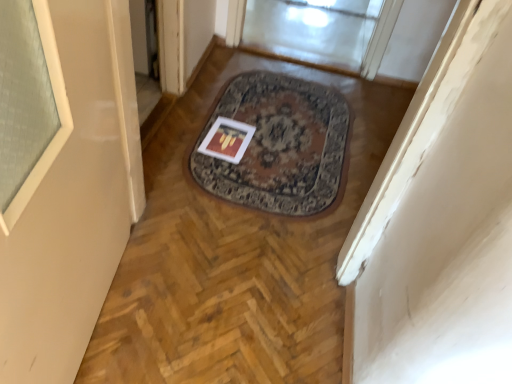
What do you see at coordinates (318, 32) in the screenshot? Image resolution: width=512 pixels, height=384 pixels. I see `transparent glass door at upper center` at bounding box center [318, 32].

I want to click on transparent glass door at upper center, so click(x=318, y=32).

What is the approximate height of transparent glass door at upper center?

1.51 inches.

Where is `matte paper postcard at center`? matte paper postcard at center is located at coordinates (227, 140).

Describe the element at coordinates (227, 140) in the screenshot. I see `matte paper postcard at center` at that location.

You are a GUI agent. You are given a task and a screenshot of the screen. Output one action in this format:
    pyautogui.click(x=<x>, y=<y>)
    Task: Click on the transparent glass door at upper center
    
    Given the screenshot: What is the action you would take?
    pyautogui.click(x=318, y=32)

Consider the image. Considering the positions of objects matte paper postcard at center and transparent glass door at upper center in the image provided, who is more to the right, matte paper postcard at center or transparent glass door at upper center?

From the viewer's perspective, transparent glass door at upper center appears more on the right side.

Relative to transparent glass door at upper center, is matte paper postcard at center in front or behind?

In the image, matte paper postcard at center appears in front of transparent glass door at upper center.

Is point (240, 143) less distant than point (317, 3)?

That is True.

From the image's perspective, is matte paper postcard at center above or below transparent glass door at upper center?

matte paper postcard at center is situated lower than transparent glass door at upper center in the image.

From a real-world perspective, between matte paper postcard at center and transparent glass door at upper center, who is vertically higher?

transparent glass door at upper center.

Considering the sizes of objects matte paper postcard at center and transparent glass door at upper center in the image provided, who is thinner, matte paper postcard at center or transparent glass door at upper center?

matte paper postcard at center is thinner.

Is matte paper postcard at center taller or shorter than transparent glass door at upper center?

Considering their sizes, matte paper postcard at center has less height than transparent glass door at upper center.

Considering the relative sizes of matte paper postcard at center and transparent glass door at upper center in the image provided, is matte paper postcard at center smaller than transparent glass door at upper center?

Answer: Yes, matte paper postcard at center is smaller than transparent glass door at upper center.

Could transparent glass door at upper center be considered to be inside matte paper postcard at center?

No, transparent glass door at upper center is not a part of matte paper postcard at center.

Is matte paper postcard at center in contact with transparent glass door at upper center?

No, matte paper postcard at center is not making contact with transparent glass door at upper center.

Is matte paper postcard at center oriented towards transparent glass door at upper center?

No, matte paper postcard at center is not aimed at transparent glass door at upper center.

How different are the orientations of matte paper postcard at center and transparent glass door at upper center in degrees?

The facing directions of matte paper postcard at center and transparent glass door at upper center are 2.4 degrees apart.

Looking at this image, measure the distance from matte paper postcard at center to transparent glass door at upper center.

matte paper postcard at center is 1.15 meters from transparent glass door at upper center.

Where is `window screen above the matte paper postcard at center (from the image's perspective)`? This screenshot has width=512, height=384. window screen above the matte paper postcard at center (from the image's perspective) is located at coordinates (318, 32).

Considering the positions of objects transparent glass door at upper center and matte paper postcard at center in the image provided, who is more to the right, transparent glass door at upper center or matte paper postcard at center?

Positioned to the right is transparent glass door at upper center.

In the image, is transparent glass door at upper center positioned in front of or behind matte paper postcard at center?

transparent glass door at upper center is positioned farther from the viewer than matte paper postcard at center.

Is point (380, 19) behind point (233, 155)?

Yes, it is behind point (233, 155).

From the image's perspective, would you say transparent glass door at upper center is positioned over matte paper postcard at center?

Yes, from the image's perspective, transparent glass door at upper center is above matte paper postcard at center.

From a real-world perspective, is transparent glass door at upper center above or below matte paper postcard at center?

From a real-world perspective, transparent glass door at upper center is physically above matte paper postcard at center.

Which of these two, transparent glass door at upper center or matte paper postcard at center, is thinner?

matte paper postcard at center.

Is transparent glass door at upper center taller than matte paper postcard at center?

Yes.

Considering the relative sizes of transparent glass door at upper center and matte paper postcard at center in the image provided, is transparent glass door at upper center smaller than matte paper postcard at center?

Incorrect, transparent glass door at upper center is not smaller in size than matte paper postcard at center.

Would you say transparent glass door at upper center contains matte paper postcard at center?

No, transparent glass door at upper center does not contain matte paper postcard at center.

Is transparent glass door at upper center directly adjacent to matte paper postcard at center?

No, transparent glass door at upper center is not touching matte paper postcard at center.

Could you tell me if transparent glass door at upper center is turned towards matte paper postcard at center?

Yes, transparent glass door at upper center faces towards matte paper postcard at center.

How different are the orientations of transparent glass door at upper center and matte paper postcard at center in degrees?

The angular difference between transparent glass door at upper center and matte paper postcard at center is 2.4 degrees.

How far apart are transparent glass door at upper center and matte paper postcard at center?

A distance of 1.15 meters exists between transparent glass door at upper center and matte paper postcard at center.

What are the coordinates of `postcard on the left of transparent glass door at upper center` in the screenshot? It's located at (227, 140).

Where is `window screen located above the matte paper postcard at center (from the image's perspective)`? The height and width of the screenshot is (384, 512). window screen located above the matte paper postcard at center (from the image's perspective) is located at coordinates (318, 32).

The image size is (512, 384). Find the location of `window screen that appears above the matte paper postcard at center (from a real-world perspective)`. window screen that appears above the matte paper postcard at center (from a real-world perspective) is located at coordinates (318, 32).